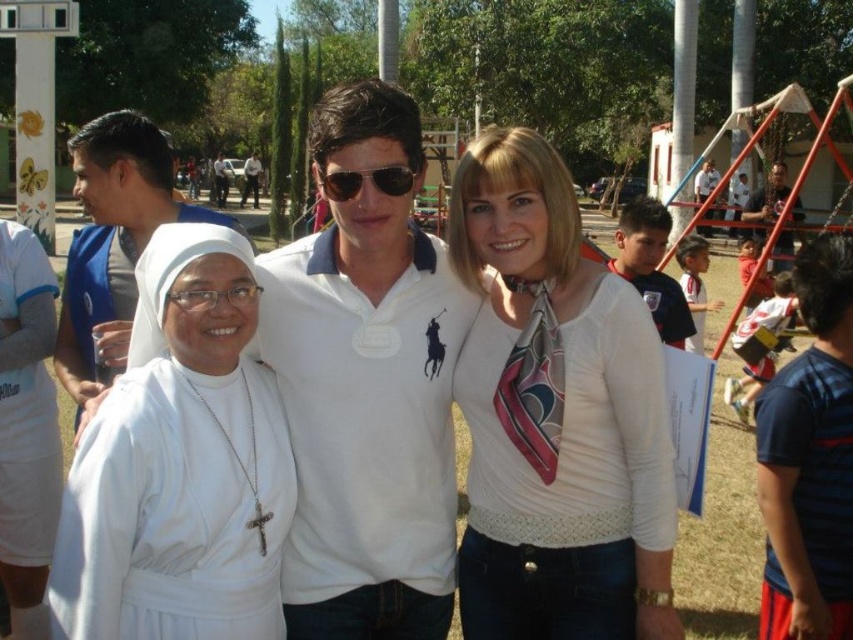
Question: Is white fabric at left wider than red cotton shirt at right?

Choices:
 (A) no
 (B) yes

Answer: (A)

Question: Which object appears closest to the camera in this image?

Choices:
 (A) white cotton shirt at right
 (B) dark blue jersey at right
 (C) striped cotton shirt at right

Answer: (B)

Question: Which is nearer to the sunglasses at center?

Choices:
 (A) white cotton shirt at right
 (B) white cotton polo shirt at center

Answer: (B)

Question: Among these points, which one is farthest from the camera?

Choices:
 (A) (137, 202)
 (B) (744, 410)
 (C) (402, 428)

Answer: (B)

Question: Does white cotton polo shirt at center have a larger size compared to striped cotton shirt at right?

Choices:
 (A) yes
 (B) no

Answer: (B)

Question: In this image, where is dark blue jersey at right located relative to red cotton shirt at right?

Choices:
 (A) above
 (B) below

Answer: (B)